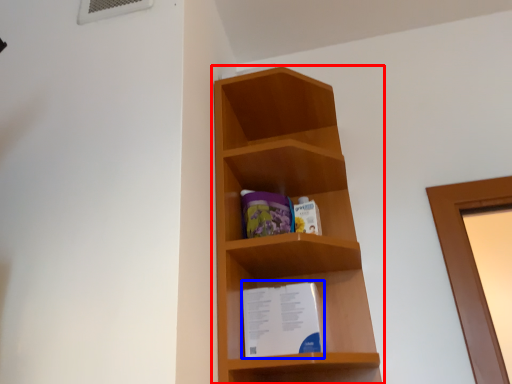
Question: Which object appears closest to the camera in this image, shelf (highlighted by a red box) or paperback book (highlighted by a blue box)?

Choices:
 (A) shelf
 (B) paperback book

Answer: (A)